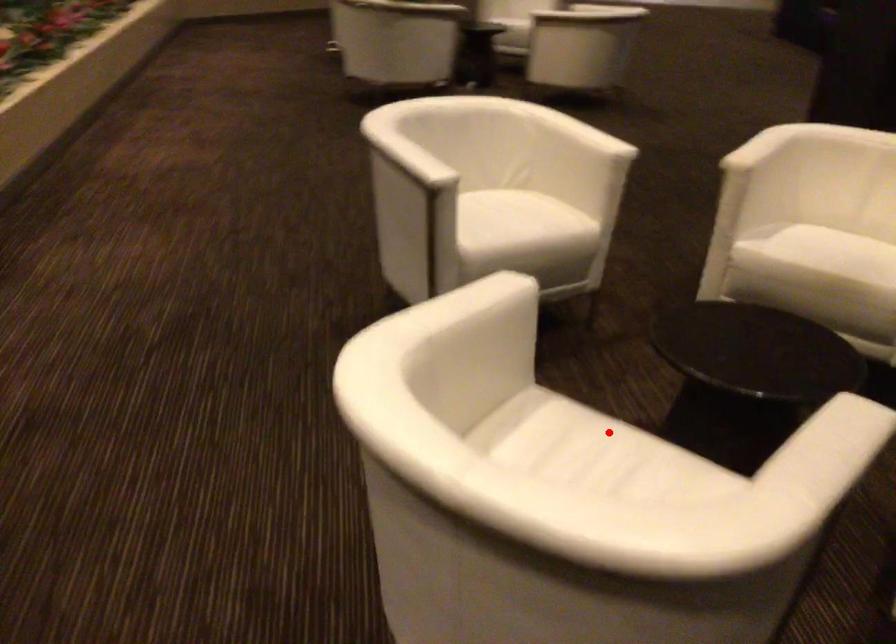
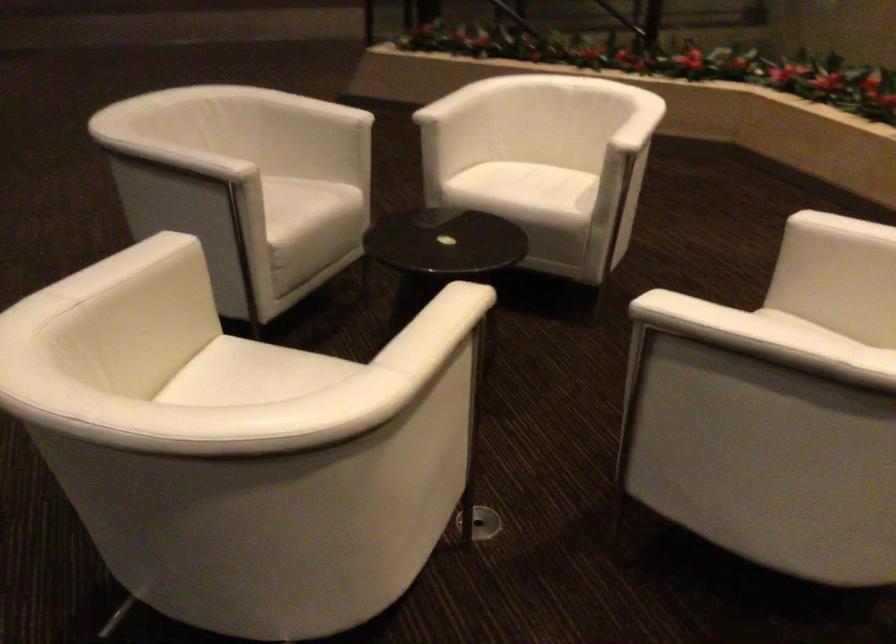
Locate, in the second image, the point that corresponds to the highlighted location in the first image.

(528, 194)